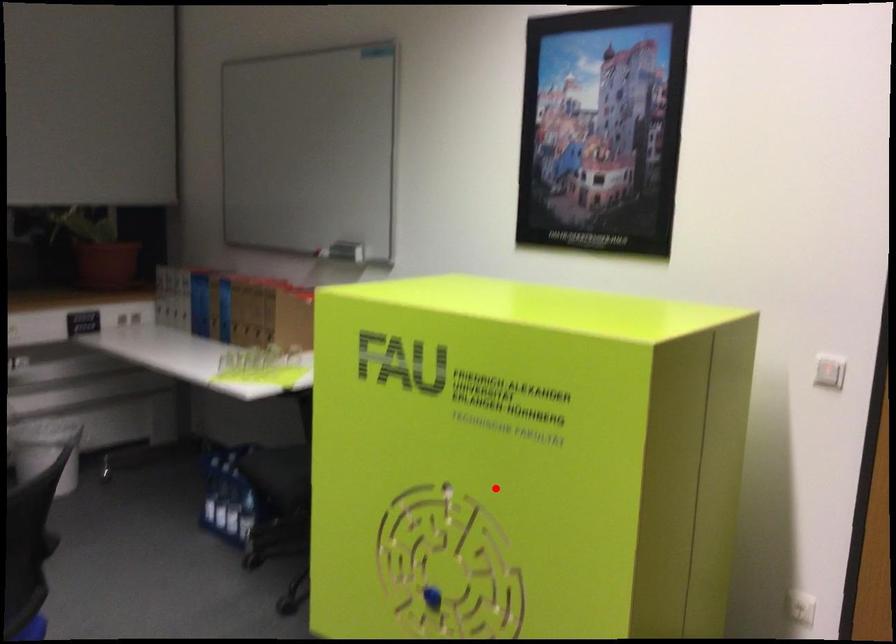
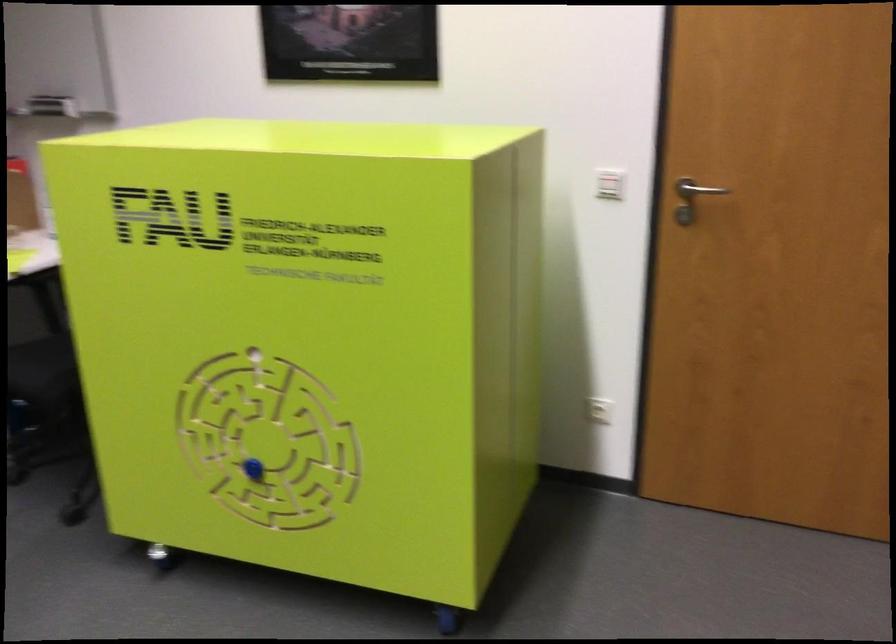
In the second image, find the point that corresponds to the highlighted location in the first image.

(309, 341)